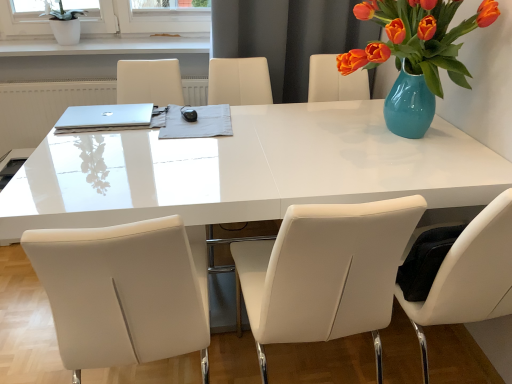
Locate an element on the screen. This screenshot has width=512, height=384. free space between silver metallic laptop at upper left and gray fabric at center is located at coordinates (129, 130).